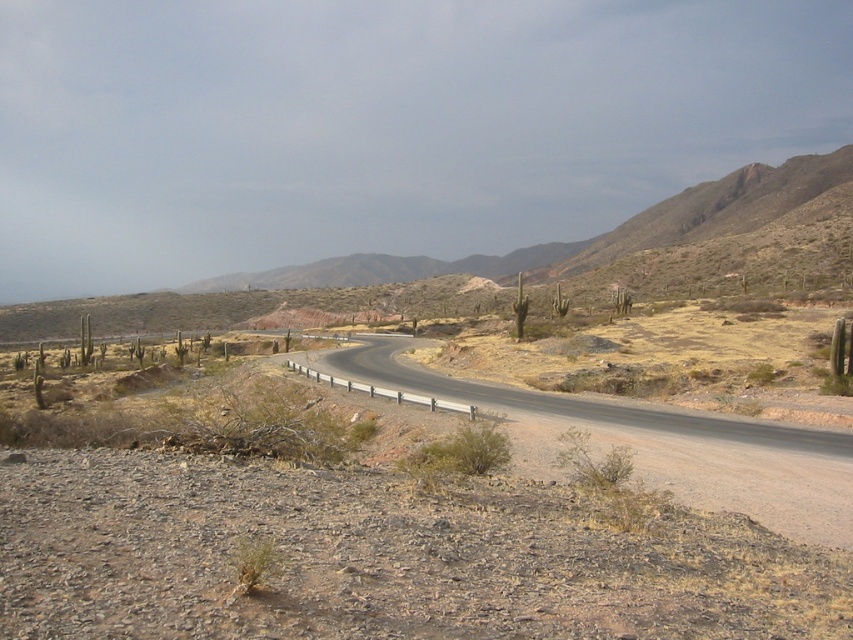
Is black asphalt road at center closer to the viewer compared to brown rocky mountain at center?

Yes, black asphalt road at center is in front of brown rocky mountain at center.

Is black asphalt road at center wider than brown rocky mountain at center?

No.

Who is more distant from viewer, (621, 436) or (755, 177)?

The point (755, 177) is behind.

What are the coordinates of `black asphalt road at center` in the screenshot? It's located at (647, 442).

Is brown dirt road at center smaller than black asphalt road at center?

No, brown dirt road at center is not smaller than black asphalt road at center.

Does point (689, 108) come farther from viewer compared to point (683, 465)?

Yes, point (689, 108) is farther from viewer.

At what (x,y) coordinates should I click in order to perform the action: click on brown dirt road at center. Please return your answer as a coordinate pair (x, y). This screenshot has height=640, width=853. Looking at the image, I should click on (381, 125).

Does brown dirt road at center have a lesser height compared to brown rocky mountain at center?

No.

Who is taller, brown dirt road at center or brown rocky mountain at center?

With more height is brown dirt road at center.

Find the location of a particular element. The width and height of the screenshot is (853, 640). brown dirt road at center is located at coordinates (381, 125).

In order to click on brown dirt road at center in this screenshot , I will do `click(381, 125)`.